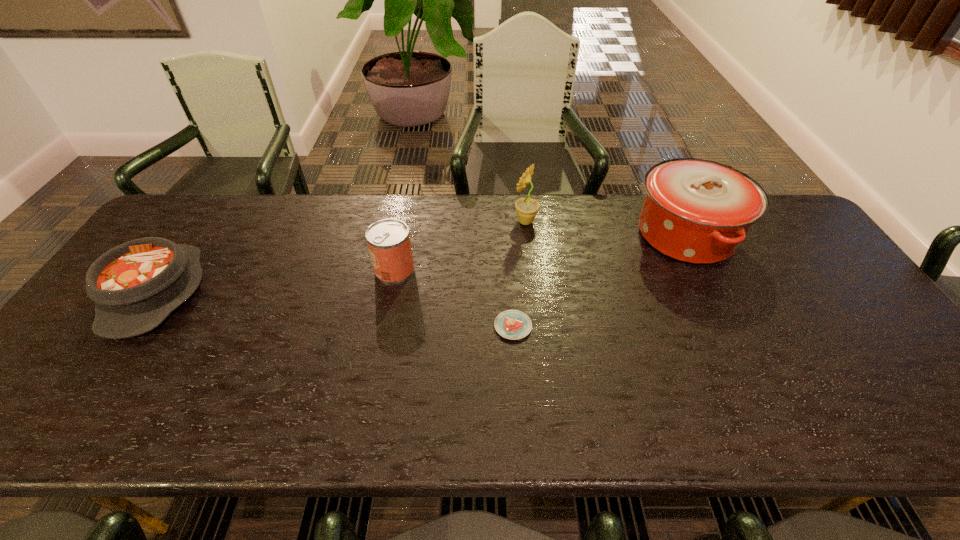
Where is `free spot at the left edge of the desktop`? free spot at the left edge of the desktop is located at coordinates tap(95, 375).

The height and width of the screenshot is (540, 960). In order to click on blank space at the right edge of the desktop in this screenshot , I will do `click(842, 292)`.

This screenshot has height=540, width=960. What are the coordinates of `free space at the far left corner of the desktop` in the screenshot? It's located at (189, 206).

Identify the location of vacant position at the near left corner of the desktop. (81, 411).

Where is `vacant space at the far right corner`? This screenshot has height=540, width=960. vacant space at the far right corner is located at coordinates (781, 237).

I want to click on free space between the shortest object and the sunflower, so click(519, 274).

This screenshot has width=960, height=540. I want to click on vacant area between the shorter casserole and the second object from left to right, so click(275, 281).

The image size is (960, 540). What are the coordinates of `vacant space in between the leftmost object and the pastry` in the screenshot? It's located at (334, 310).

Locate an element on the screen. The height and width of the screenshot is (540, 960). free point between the sunflower and the fourth object from right to left is located at coordinates (460, 245).

Identify the location of free space between the sunflower and the pastry. (519, 274).